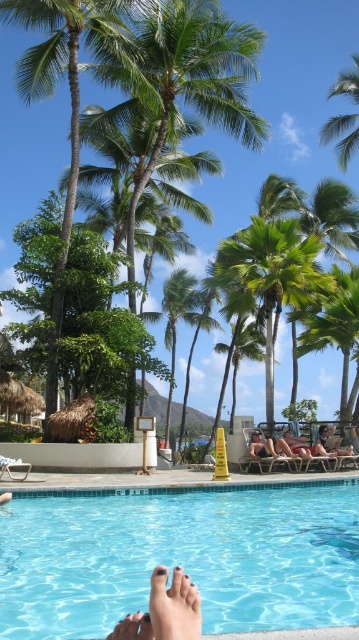
What do you see at coordinates (180, 557) in the screenshot? Image resolution: width=359 pixels, height=640 pixels. I see `blue glossy water at lower center` at bounding box center [180, 557].

Does blue glossy water at lower center appear on the right side of matte black toe at lower center?

Indeed, blue glossy water at lower center is positioned on the right side of matte black toe at lower center.

Which is in front, point (99, 577) or point (173, 609)?

Point (173, 609)

I want to click on blue glossy water at lower center, so click(180, 557).

Who is taller, matte black toe at lower center or tan leather chair at lower center?

With more height is tan leather chair at lower center.

Can you confirm if matte black toe at lower center is positioned to the right of tan leather chair at lower center?

In fact, matte black toe at lower center is to the left of tan leather chair at lower center.

The width and height of the screenshot is (359, 640). Describe the element at coordinates (174, 605) in the screenshot. I see `matte black toe at lower center` at that location.

The image size is (359, 640). What are the coordinates of `matte black toe at lower center` in the screenshot? It's located at (174, 605).

Does green leafy palm tree at left have a greater height compared to matte black toe at lower center?

Correct, green leafy palm tree at left is much taller as matte black toe at lower center.

Does green leafy palm tree at left have a lesser height compared to matte black toe at lower center?

In fact, green leafy palm tree at left may be taller than matte black toe at lower center.

In order to click on green leafy palm tree at left in this screenshot , I will do `click(71, 99)`.